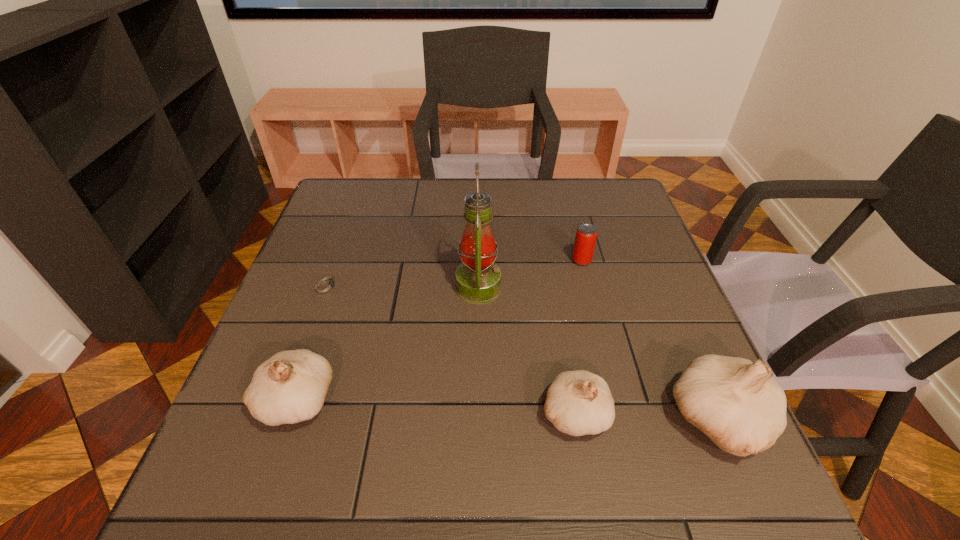
At what (x,y) coordinates should I click in order to perform the action: click on vacant space located 0.070m on the left of the rightmost garlic. Please return your answer as a coordinate pair (x, y). This screenshot has height=540, width=960. Looking at the image, I should click on point(632,421).

In order to click on free spot located on the left of the oil lamp in this screenshot , I will do `click(294, 287)`.

At what (x,y) coordinates should I click in order to perform the action: click on vacant space located 0.390m on the face of the watch. Please return your answer as a coordinate pair (x, y). Image resolution: width=960 pixels, height=540 pixels. Looking at the image, I should click on (506, 286).

You are a GUI agent. You are given a task and a screenshot of the screen. Output one action in this format:
    pyautogui.click(x=<x>, y=<y>)
    Task: Click on the vacant region located on the front of the beer can
    
    Given the screenshot: What is the action you would take?
    pyautogui.click(x=600, y=334)

Identify the location of garlic that is at the left edge. Image resolution: width=960 pixels, height=540 pixels. [x=290, y=387].

The width and height of the screenshot is (960, 540). Find the location of `watch positioned at the left edge`. watch positioned at the left edge is located at coordinates (326, 285).

Identify the location of object present at the right edge. (737, 403).

The height and width of the screenshot is (540, 960). I want to click on object that is at the near left corner, so point(290,387).

Find the location of a particular element. This screenshot has height=540, width=960. object situated at the near right corner is located at coordinates (737, 403).

This screenshot has width=960, height=540. I want to click on vacant space at the far edge, so click(x=517, y=220).